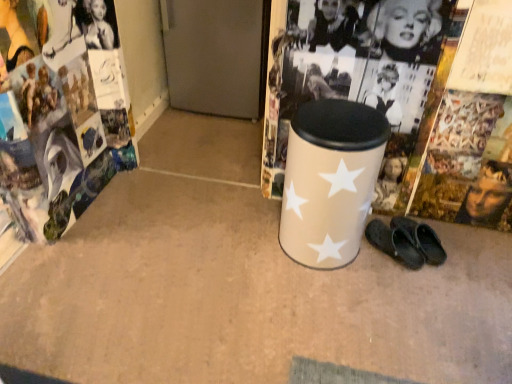
Question: Is black rubber slippers at lower right in contact with matte paper magazine at left?

Choices:
 (A) no
 (B) yes

Answer: (A)

Question: Can you confirm if black rubber slippers at lower right is bigger than matte paper magazine at left?

Choices:
 (A) no
 (B) yes

Answer: (A)

Question: From the image's perspective, does black rubber slippers at lower right appear higher than matte paper magazine at left?

Choices:
 (A) no
 (B) yes

Answer: (A)

Question: Can you confirm if black rubber slippers at lower right is shorter than matte paper magazine at left?

Choices:
 (A) no
 (B) yes

Answer: (A)

Question: Could you tell me if black rubber slippers at lower right is turned towards matte paper magazine at left?

Choices:
 (A) no
 (B) yes

Answer: (A)

Question: From a real-world perspective, does black rubber slippers at lower right stand above matte paper magazine at left?

Choices:
 (A) yes
 (B) no

Answer: (A)

Question: Considering the relative sizes of matte paper magazine at left and black rubber slippers at lower right in the image provided, is matte paper magazine at left smaller than black rubber slippers at lower right?

Choices:
 (A) no
 (B) yes

Answer: (A)

Question: Are matte paper magazine at left and black rubber slippers at lower right making contact?

Choices:
 (A) yes
 (B) no

Answer: (B)

Question: Considering the relative sizes of matte paper magazine at left and black rubber slippers at lower right in the image provided, is matte paper magazine at left shorter than black rubber slippers at lower right?

Choices:
 (A) no
 (B) yes

Answer: (B)

Question: From the image's perspective, is matte paper magazine at left above black rubber slippers at lower right?

Choices:
 (A) yes
 (B) no

Answer: (A)

Question: Is matte paper magazine at left far from black rubber slippers at lower right?

Choices:
 (A) no
 (B) yes

Answer: (B)

Question: Considering the relative sizes of matte paper magazine at left and black rubber slippers at lower right in the image provided, is matte paper magazine at left thinner than black rubber slippers at lower right?

Choices:
 (A) no
 (B) yes

Answer: (A)

Question: Considering the relative sizes of beige matte waste container at center and matte paper magazine at left in the image provided, is beige matte waste container at center shorter than matte paper magazine at left?

Choices:
 (A) no
 (B) yes

Answer: (A)